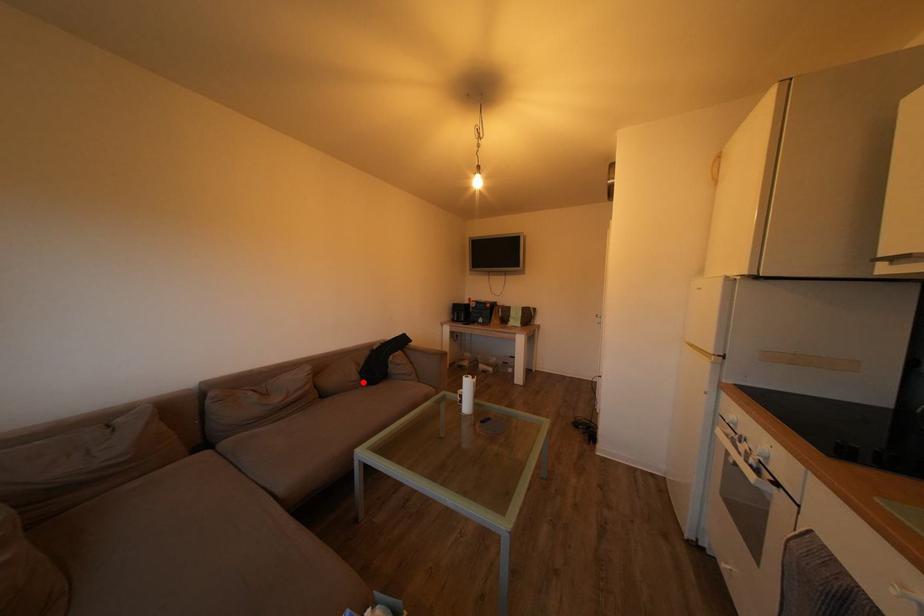
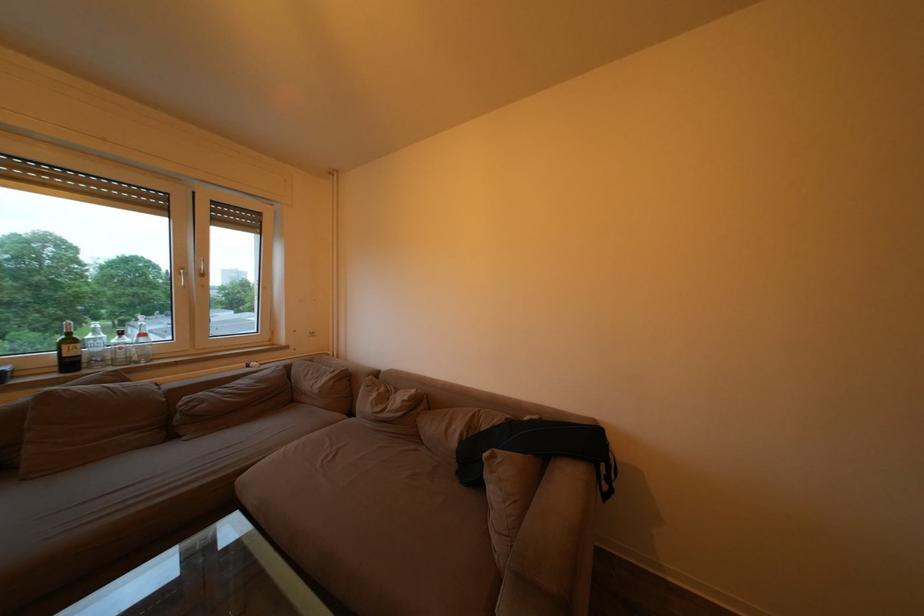
Locate, in the second image, the point that corresponds to the highlighted location in the first image.

(463, 448)